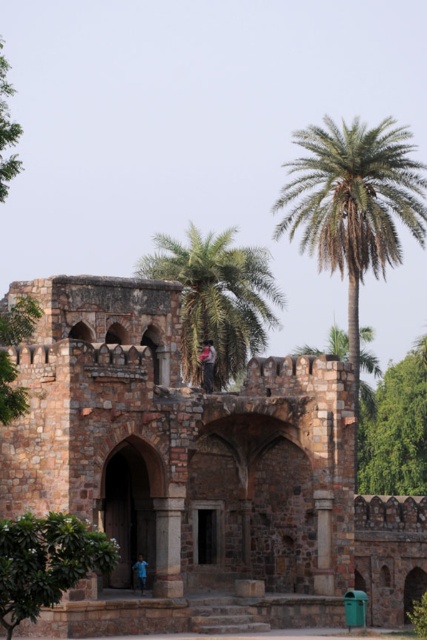
Question: Among these points, which one is farthest from the camera?

Choices:
 (A) (46, 326)
 (B) (44, 596)

Answer: (A)

Question: Which point is closer to the camera?

Choices:
 (A) (186, 580)
 (B) (315, 140)
 (C) (242, 276)
 (D) (90, 534)

Answer: (D)

Question: From the image, what is the correct spatial relationship of green leafy palm at upper right in relation to green leafy palm tree at center?

Choices:
 (A) right
 (B) left

Answer: (A)

Question: Does green leafy palm at upper right appear on the left side of green leafy palm tree at center?

Choices:
 (A) no
 (B) yes

Answer: (A)

Question: Does green leafy palm at upper right appear on the left side of green leafy tree at lower left?

Choices:
 (A) no
 (B) yes

Answer: (A)

Question: Estimate the real-world distances between objects in this image. Which object is farther from the brown stone fort at center?

Choices:
 (A) green leafy palm at upper right
 (B) green leafy tree at lower left

Answer: (A)